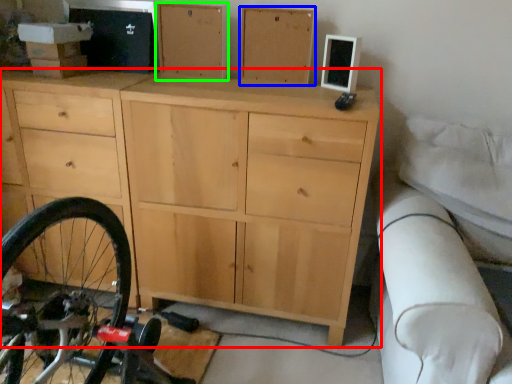
Question: Estimate the real-world distances between objects in this image. Which object is closer to chest of drawers (highlighted by a red box), chest of drawer (highlighted by a blue box) or chest of drawer (highlighted by a green box)?

Choices:
 (A) chest of drawer
 (B) chest of drawer

Answer: (B)